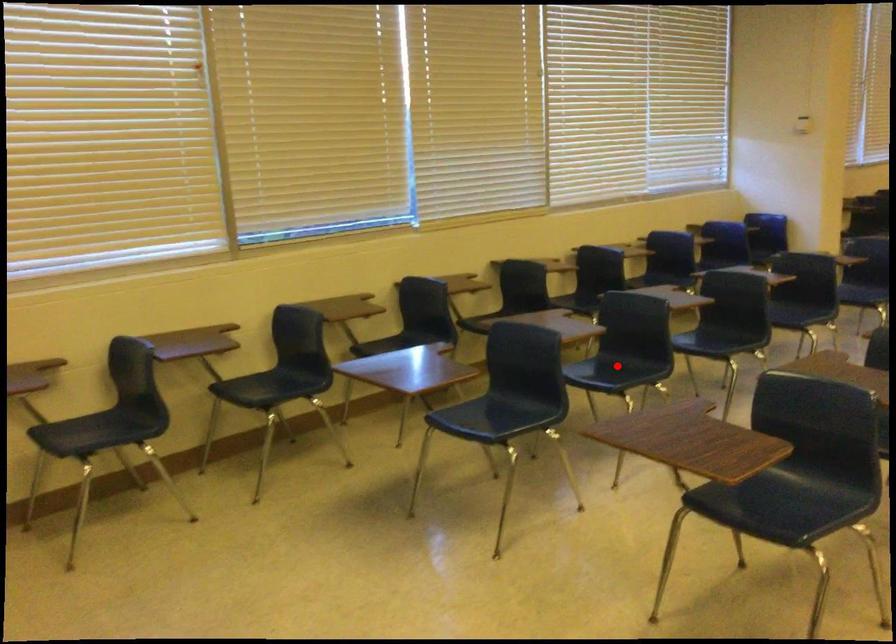
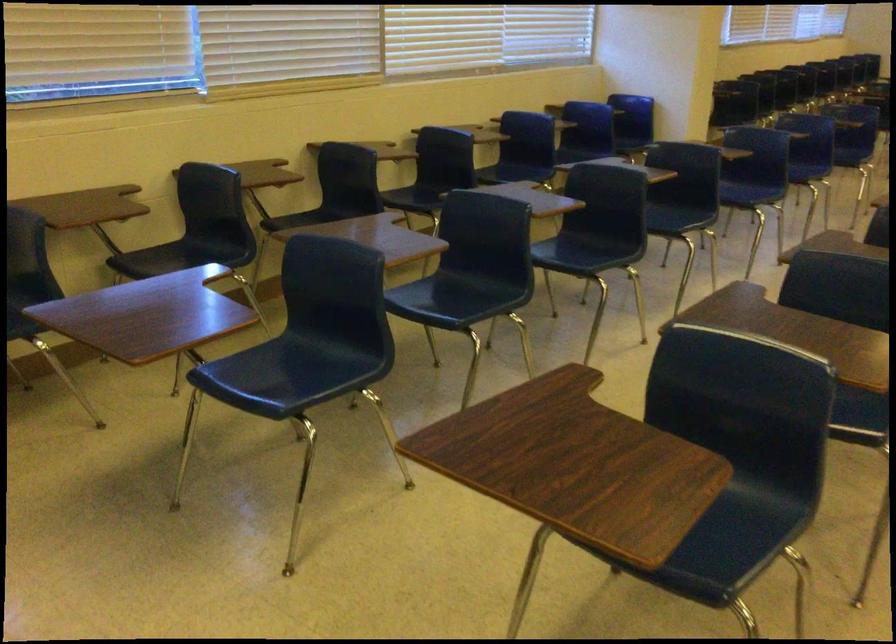
Question: I am providing you with two images of the same scene from different viewpoints. A red point is marked on the first image. At the location where the point appears in image 1, is it still visible in image 2?

Choices:
 (A) Yes
 (B) No

Answer: (A)